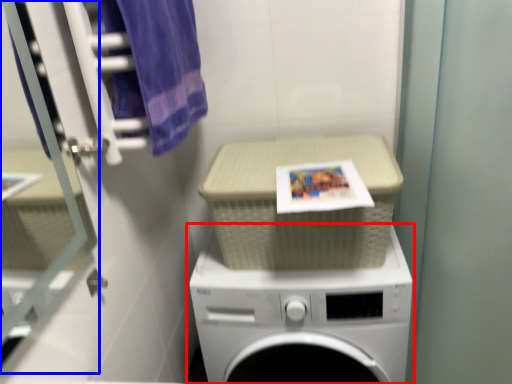
Question: Among these objects, which one is nearest to the camera, washing machine (highlighted by a red box) or glass door (highlighted by a blue box)?

Choices:
 (A) washing machine
 (B) glass door

Answer: (B)